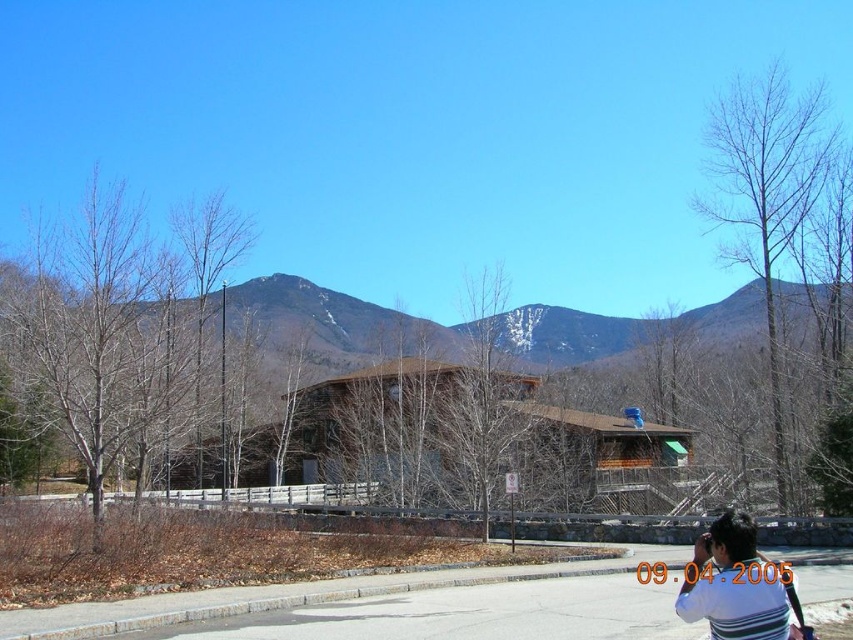
Question: Which object is positioned closest to the bare wood tree at center?

Choices:
 (A) bare branches at left
 (B) bare wood tree at right
 (C) snowy brown mountain at center

Answer: (C)

Question: Is bare branches at left to the right of snowy brown mountain at center from the viewer's perspective?

Choices:
 (A) no
 (B) yes

Answer: (A)

Question: Does bare wood tree at right have a lesser width compared to bare wood tree at center?

Choices:
 (A) no
 (B) yes

Answer: (A)

Question: Which point is farther to the camera?

Choices:
 (A) snowy brown mountain at center
 (B) bare branches at left

Answer: (A)

Question: Observing the image, what is the correct spatial positioning of snowy brown mountain at center in reference to white striped shirt at lower right?

Choices:
 (A) left
 (B) right

Answer: (A)

Question: Which object is closer to the camera taking this photo?

Choices:
 (A) white striped shirt at lower right
 (B) bare wood tree at center
 (C) bare wood tree at right

Answer: (A)